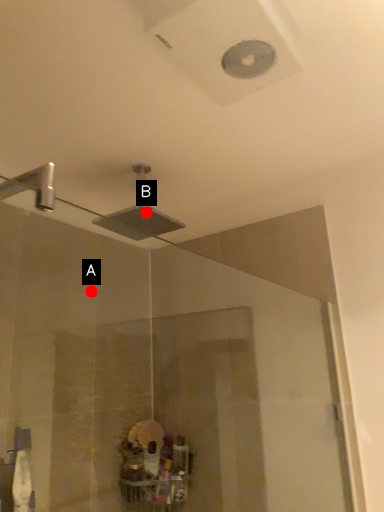
Question: Two points are circled on the image, labeled by A and B beside each circle. Which point is closer to the camera?

Choices:
 (A) A is closer
 (B) B is closer

Answer: (B)